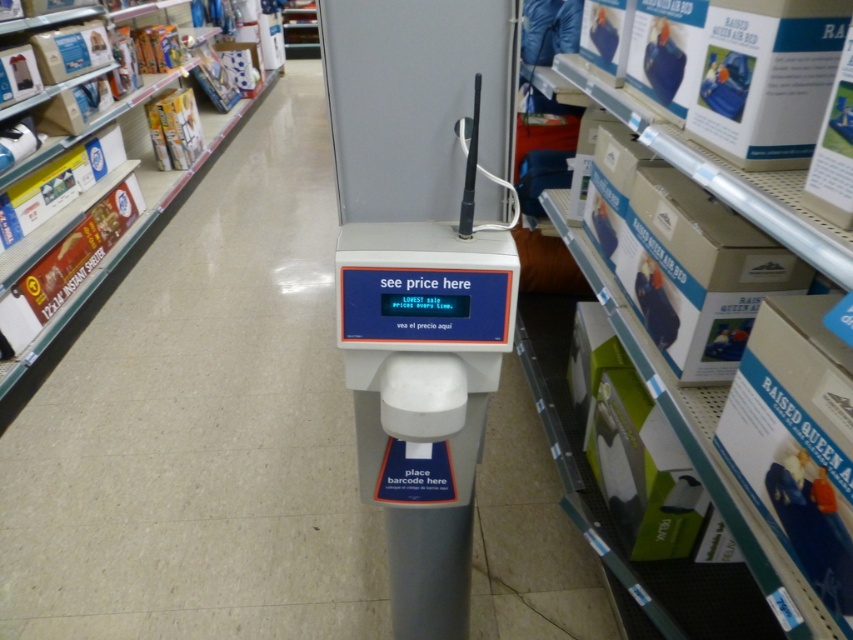
Question: Which of the following is the closest to the observer?

Choices:
 (A) white cardboard boxes at left
 (B) white plastic scale at center

Answer: (B)

Question: Can you confirm if white plastic scale at center is positioned to the right of white cardboard boxes at left?

Choices:
 (A) no
 (B) yes

Answer: (B)

Question: Which object appears farthest from the camera in this image?

Choices:
 (A) white plastic scale at center
 (B) white cardboard boxes at left

Answer: (B)

Question: Is white plastic scale at center below white cardboard boxes at left?

Choices:
 (A) no
 (B) yes

Answer: (B)

Question: Can you confirm if white plastic scale at center is wider than white cardboard boxes at left?

Choices:
 (A) yes
 (B) no

Answer: (B)